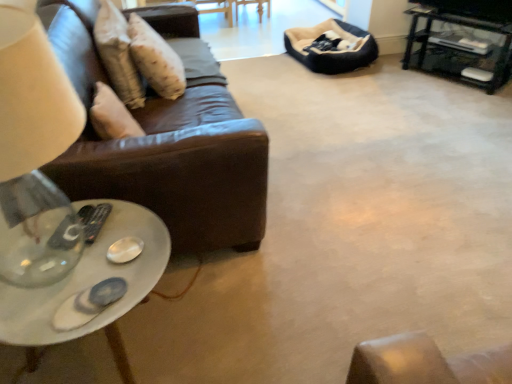
Question: Should I look upward or downward to see black plastic remote at lower left?

Choices:
 (A) down
 (B) up

Answer: (A)

Question: From a real-world perspective, does black metal tv stand at upper right stand above transparent glass table lamp at left?

Choices:
 (A) no
 (B) yes

Answer: (A)

Question: From the image's perspective, is black metal tv stand at upper right located above transparent glass table lamp at left?

Choices:
 (A) no
 (B) yes

Answer: (B)

Question: Would you say transparent glass table lamp at left is part of black metal tv stand at upper right's contents?

Choices:
 (A) yes
 (B) no

Answer: (B)

Question: Could you tell me if black metal tv stand at upper right is turned towards transparent glass table lamp at left?

Choices:
 (A) no
 (B) yes

Answer: (B)

Question: Is black metal tv stand at upper right oriented away from transparent glass table lamp at left?

Choices:
 (A) no
 (B) yes

Answer: (A)

Question: From a real-world perspective, is black metal tv stand at upper right located beneath transparent glass table lamp at left?

Choices:
 (A) yes
 (B) no

Answer: (A)

Question: Is black metal tv stand at upper right at the left side of dark blue plush bean bag at upper right?

Choices:
 (A) yes
 (B) no

Answer: (B)

Question: Is the surface of black metal tv stand at upper right in direct contact with dark blue plush bean bag at upper right?

Choices:
 (A) no
 (B) yes

Answer: (A)

Question: Considering the relative sizes of black metal tv stand at upper right and dark blue plush bean bag at upper right in the image provided, is black metal tv stand at upper right thinner than dark blue plush bean bag at upper right?

Choices:
 (A) no
 (B) yes

Answer: (B)

Question: Is dark blue plush bean bag at upper right located within black metal tv stand at upper right?

Choices:
 (A) no
 (B) yes

Answer: (A)

Question: Is black metal tv stand at upper right outside dark blue plush bean bag at upper right?

Choices:
 (A) yes
 (B) no

Answer: (A)

Question: Can you confirm if black metal tv stand at upper right is smaller than dark blue plush bean bag at upper right?

Choices:
 (A) yes
 (B) no

Answer: (B)

Question: Is there a large distance between black metal tv stand at upper right and white glossy coffee table at lower left?

Choices:
 (A) no
 (B) yes

Answer: (B)